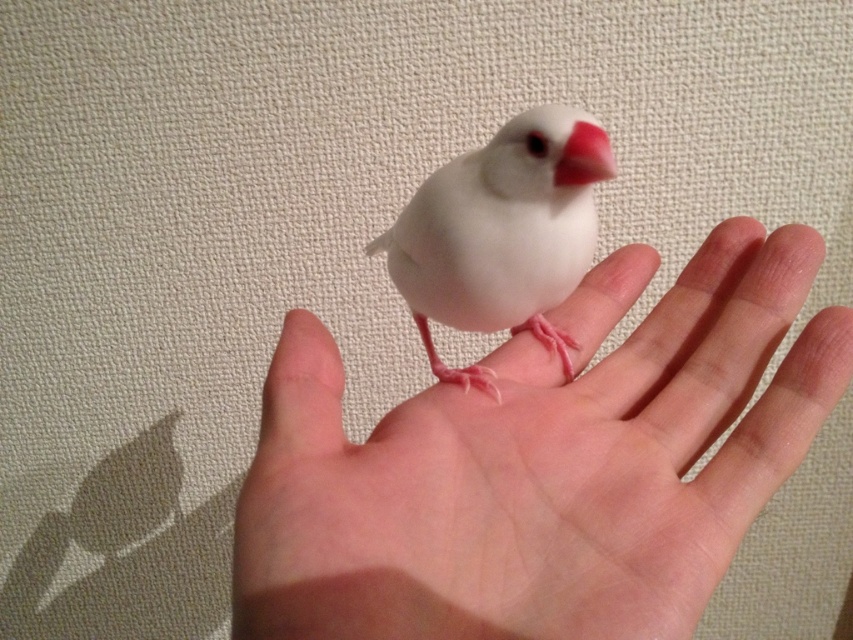
Question: Does smooth skin palm at center appear on the left side of matte pink beak at center?

Choices:
 (A) no
 (B) yes

Answer: (B)

Question: Among these points, which one is farthest from the camera?

Choices:
 (A) (601, 496)
 (B) (579, 172)
 (C) (555, 132)

Answer: (C)

Question: Does smooth skin palm at center lie behind matte pink beak at center?

Choices:
 (A) no
 (B) yes

Answer: (A)

Question: Which object is positioned closest to the matte pink beak at center?

Choices:
 (A) white matte bird at center
 (B) smooth skin palm at center

Answer: (A)

Question: Which of the following is the closest to the observer?

Choices:
 (A) (427, 346)
 (B) (590, 152)
 (C) (714, 289)

Answer: (B)

Question: Is the position of smooth skin palm at center less distant than that of white matte bird at center?

Choices:
 (A) no
 (B) yes

Answer: (B)